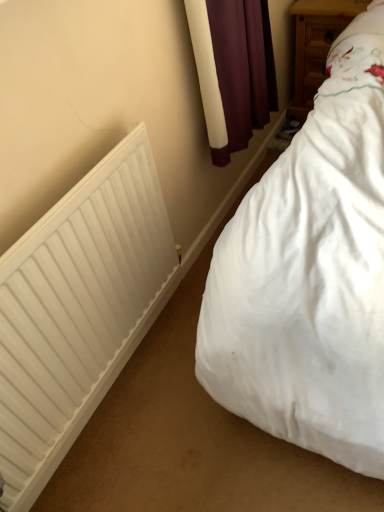
This screenshot has width=384, height=512. Find the location of `free area below white matte radiator at left (from a real-world perspective)`. free area below white matte radiator at left (from a real-world perspective) is located at coordinates (122, 379).